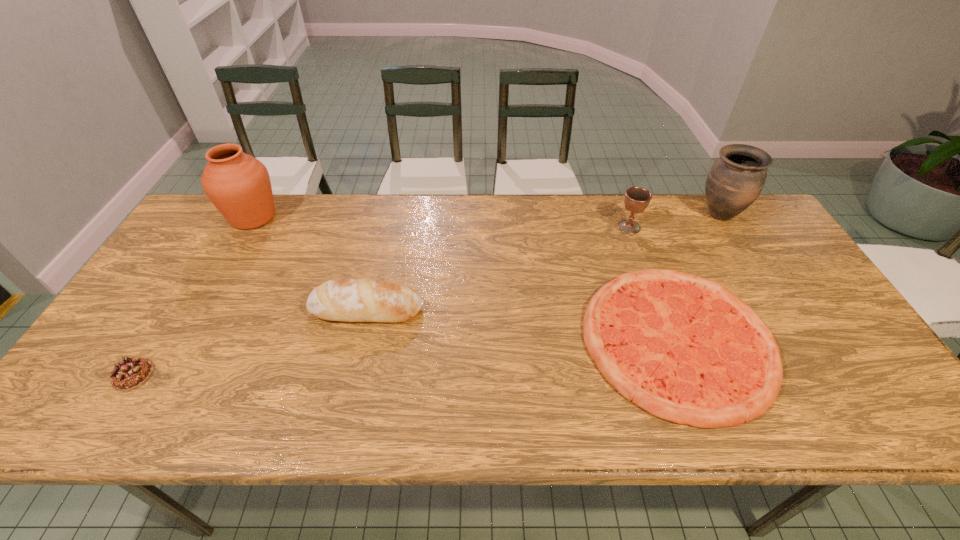
In order to click on free space at the far edge of the desktop in this screenshot , I will do `click(278, 237)`.

Where is `free space at the near edge`? free space at the near edge is located at coordinates (318, 395).

In the image, there is a desktop. In order to click on free space at the left edge in this screenshot , I will do `click(167, 295)`.

The height and width of the screenshot is (540, 960). I want to click on vacant area at the right edge, so pyautogui.click(x=787, y=259).

In the image, there is a desktop. At what (x,y) coordinates should I click in order to perform the action: click on vacant space at the far left corner. Please return your answer as a coordinate pair (x, y). This screenshot has width=960, height=540. Looking at the image, I should click on (208, 237).

Where is `free spot at the near left corner of the desktop`? The height and width of the screenshot is (540, 960). free spot at the near left corner of the desktop is located at coordinates (104, 421).

Find the location of a particular element. The image size is (960, 540). free spot at the near right corner of the desktop is located at coordinates pyautogui.click(x=887, y=417).

Locate an element on the screen. vacant region between the chocolate cake and the right urn is located at coordinates (426, 295).

At what (x,y) coordinates should I click in order to perform the action: click on unoccupied position between the left urn and the right urn. Please return your answer as a coordinate pair (x, y). The width and height of the screenshot is (960, 540). Looking at the image, I should click on (486, 216).

In order to click on vacant area that lies between the pizza and the chocolate cake in this screenshot , I will do `click(405, 357)`.